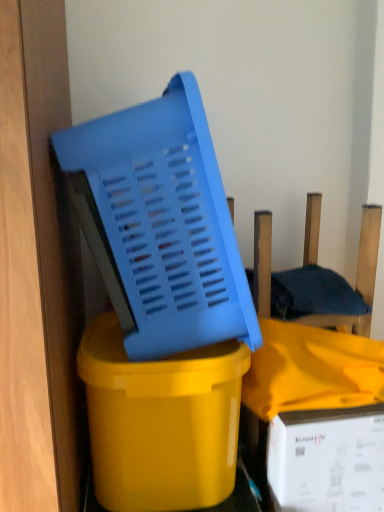
Where is `blue plastic chair at center`? blue plastic chair at center is located at coordinates (368, 252).

The height and width of the screenshot is (512, 384). I want to click on blue plastic basket at center, so click(x=160, y=224).

Is white cardboard box at lower right with yellow glossy plastic bucket at center?

No, white cardboard box at lower right is not beside yellow glossy plastic bucket at center.

Is white cardboard box at lower right looking in the opposite direction of yellow glossy plastic bucket at center?

white cardboard box at lower right is not turned away from yellow glossy plastic bucket at center.

Which of these two, white cardboard box at lower right or yellow glossy plastic bucket at center, stands taller?

yellow glossy plastic bucket at center is taller.

What are the coordinates of `waste container on the left side of white cardboard box at lower right` in the screenshot? It's located at (161, 422).

Which of these two, white cardboard box at lower right or blue plastic basket at center, is bigger?

A: Bigger between the two is blue plastic basket at center.

Which of these two, white cardboard box at lower right or blue plastic basket at center, stands shorter?

white cardboard box at lower right.

In the scene shown: Are white cardboard box at lower right and blue plastic basket at center far apart?

No, there isn't a large distance between white cardboard box at lower right and blue plastic basket at center.

Does white cardboard box at lower right appear on the left side of blue plastic basket at center?

Incorrect, white cardboard box at lower right is not on the left side of blue plastic basket at center.

Considering the relative sizes of blue plastic chair at center and yellow glossy plastic bucket at center in the image provided, is blue plastic chair at center bigger than yellow glossy plastic bucket at center?

No, blue plastic chair at center is not bigger than yellow glossy plastic bucket at center.

Is blue plastic chair at center at the left side of yellow glossy plastic bucket at center?

No.

Considering the relative sizes of blue plastic chair at center and yellow glossy plastic bucket at center in the image provided, is blue plastic chair at center taller than yellow glossy plastic bucket at center?

Result: No, blue plastic chair at center is not taller than yellow glossy plastic bucket at center.

Looking at this image, from a real-world perspective, which is physically below, blue plastic chair at center or yellow glossy plastic bucket at center?

From a 3D spatial view, yellow glossy plastic bucket at center is below.

Looking at this image, which is farther from the camera, (158, 315) or (330, 317)?

Point (330, 317)

Between blue plastic basket at center and blue plastic chair at center, which one has smaller size?

blue plastic chair at center.

Can you confirm if blue plastic basket at center is shorter than blue plastic chair at center?

Incorrect, the height of blue plastic basket at center does not fall short of that of blue plastic chair at center.

Which of these two, blue plastic basket at center or blue plastic chair at center, is thinner?

With smaller width is blue plastic chair at center.

In the image, is blue plastic chair at center positioned in front of or behind blue plastic basket at center?

Visually, blue plastic chair at center is located behind blue plastic basket at center.

Does blue plastic chair at center touch blue plastic basket at center?

blue plastic chair at center is not next to blue plastic basket at center, and they're not touching.

Based on the photo, is blue plastic chair at center facing away from blue plastic basket at center?

blue plastic chair at center does not have its back to blue plastic basket at center.

Can you confirm if blue plastic chair at center is thinner than blue plastic basket at center?

Yes, blue plastic chair at center is thinner than blue plastic basket at center.

From the image's perspective, is yellow glossy plastic bucket at center under blue plastic chair at center?

Yes.

How different are the orientations of yellow glossy plastic bucket at center and blue plastic chair at center in degrees?

0.717 degrees separate the facing orientations of yellow glossy plastic bucket at center and blue plastic chair at center.

Would you say yellow glossy plastic bucket at center is outside blue plastic chair at center?

Absolutely, yellow glossy plastic bucket at center is external to blue plastic chair at center.

Can you confirm if yellow glossy plastic bucket at center is positioned to the left of blue plastic chair at center?

Indeed, yellow glossy plastic bucket at center is positioned on the left side of blue plastic chair at center.

Is the depth of blue plastic basket at center less than that of yellow glossy plastic bucket at center?

Yes, blue plastic basket at center is closer to the viewer.

Is blue plastic basket at center thinner than yellow glossy plastic bucket at center?

Incorrect, the width of blue plastic basket at center is not less than that of yellow glossy plastic bucket at center.

Is blue plastic basket at center bigger than yellow glossy plastic bucket at center?

Yes.

Which of these two, blue plastic basket at center or yellow glossy plastic bucket at center, stands shorter?

With less height is yellow glossy plastic bucket at center.

Identify the location of box behind the yellow glossy plastic bucket at center. (327, 460).

I want to click on basket above the white cardboard box at lower right (from the image's perspective), so click(160, 224).

From the image, which object appears to be farther from blue plastic chair at center, blue plastic basket at center or white cardboard box at lower right?

Based on the image, white cardboard box at lower right appears to be further to blue plastic chair at center.

When comparing their distances from blue plastic chair at center, does blue plastic basket at center or yellow glossy plastic bucket at center seem further?

yellow glossy plastic bucket at center is positioned further to the anchor blue plastic chair at center.

Considering their positions, is white cardboard box at lower right positioned closer to blue plastic basket at center than yellow glossy plastic bucket at center?

yellow glossy plastic bucket at center is closer to blue plastic basket at center.

Which object lies further to the anchor point white cardboard box at lower right, yellow glossy plastic bucket at center or blue plastic basket at center?

blue plastic basket at center is positioned further to the anchor white cardboard box at lower right.

Looking at the image, which one is located closer to yellow glossy plastic bucket at center, white cardboard box at lower right or blue plastic chair at center?

Among the two, white cardboard box at lower right is located nearer to yellow glossy plastic bucket at center.

Consider the image. Estimate the real-world distances between objects in this image. Which object is further from white cardboard box at lower right, blue plastic chair at center or blue plastic basket at center?

blue plastic basket at center.

Looking at the image, which one is located further to yellow glossy plastic bucket at center, white cardboard box at lower right or blue plastic basket at center?

Based on the image, white cardboard box at lower right appears to be further to yellow glossy plastic bucket at center.

Based on their spatial positions, is blue plastic chair at center or yellow glossy plastic bucket at center closer to blue plastic basket at center?

Based on the image, yellow glossy plastic bucket at center appears to be nearer to blue plastic basket at center.

Locate an element on the screen. Image resolution: width=384 pixels, height=512 pixels. waste container between blue plastic chair at center and white cardboard box at lower right from top to bottom is located at coordinates (161, 422).

I want to click on chair between blue plastic basket at center and yellow glossy plastic bucket at center from top to bottom, so click(x=368, y=252).

You are a GUI agent. You are given a task and a screenshot of the screen. Output one action in this format:
    pyautogui.click(x=<x>, y=<y>)
    Task: Click on the chair that lies between blue plastic basket at center and white cardboard box at lower right from top to bottom
    
    Given the screenshot: What is the action you would take?
    pyautogui.click(x=368, y=252)

Identify the location of waste container between blue plastic basket at center and white cardboard box at lower right in the vertical direction. (161, 422).